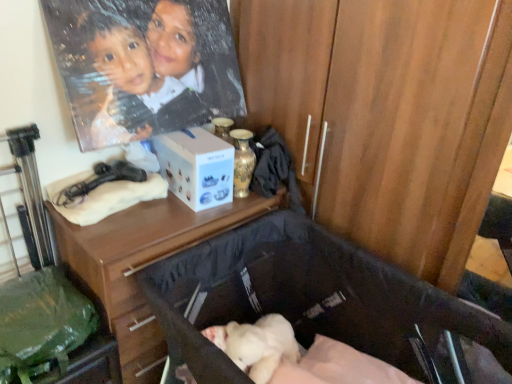
Image resolution: width=512 pixels, height=384 pixels. I want to click on free space in front of matte black hairdryer at upper left, so click(x=110, y=228).